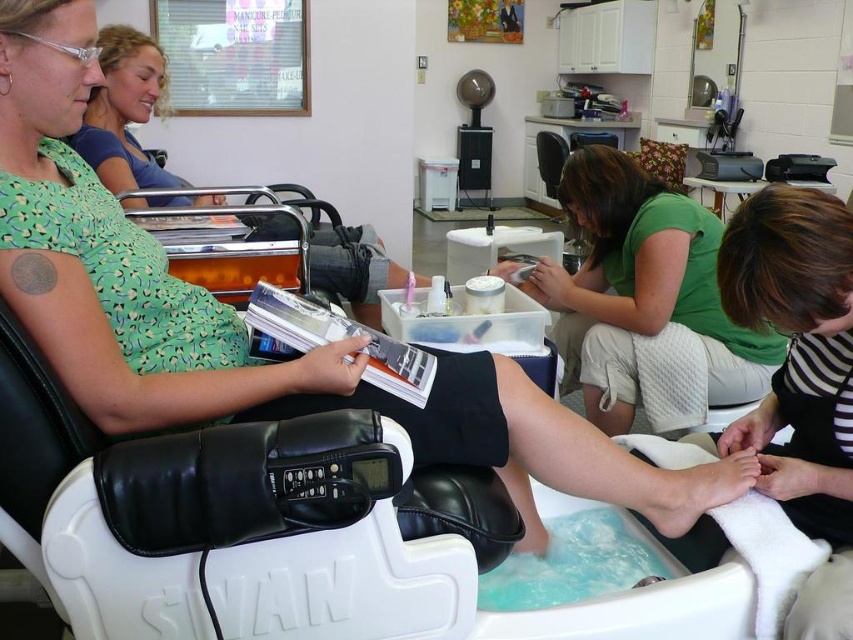
Question: Can you confirm if green matte shirt at center is positioned below green matte dress at upper left?

Choices:
 (A) no
 (B) yes

Answer: (B)

Question: Which point is farther to the camera?

Choices:
 (A) green matte dress at upper left
 (B) green matte shirt at center

Answer: (A)

Question: Does green matte shirt at center appear over green matte dress at upper left?

Choices:
 (A) yes
 (B) no

Answer: (B)

Question: Is green matte shirt at center smaller than green matte dress at upper left?

Choices:
 (A) yes
 (B) no

Answer: (A)